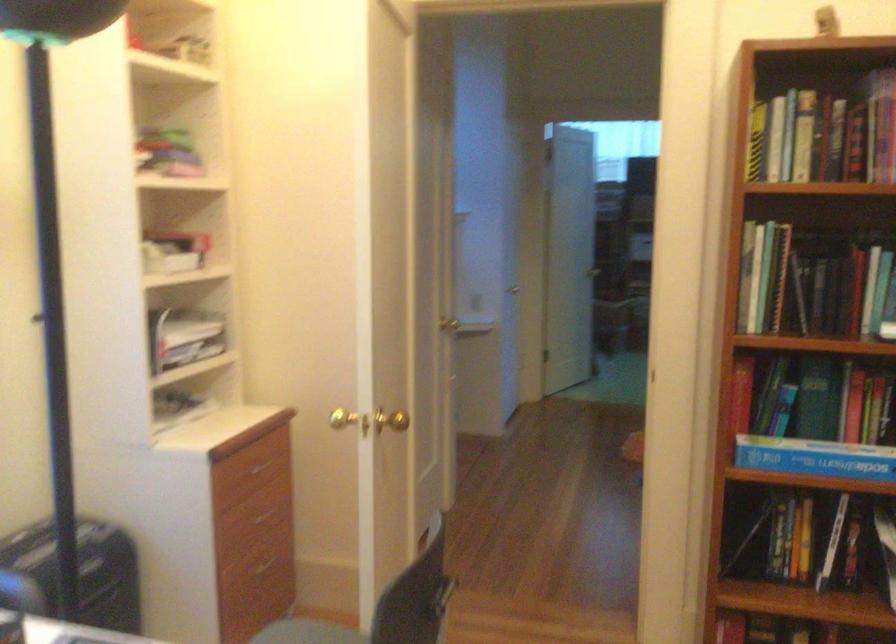
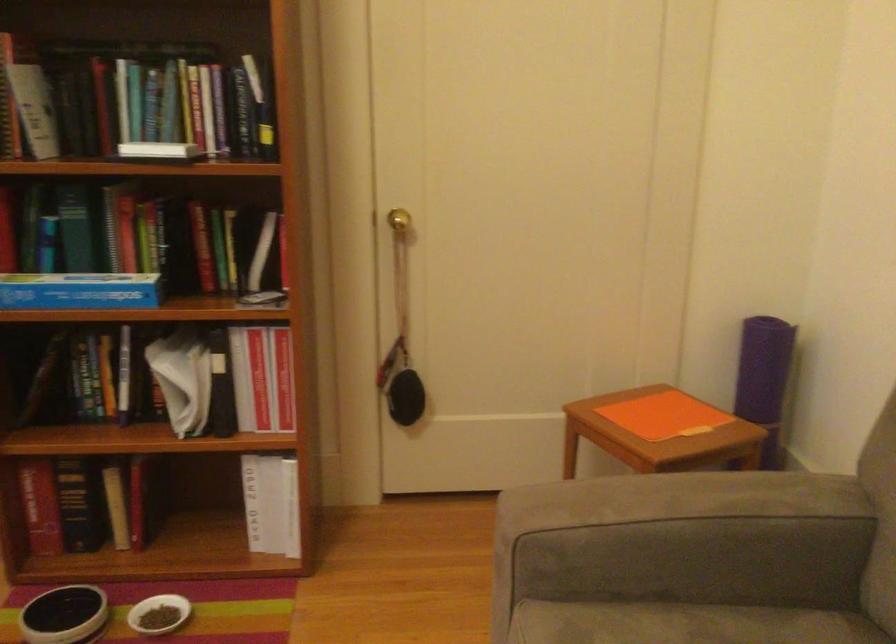
Question: The camera is either moving clockwise (left) or counter-clockwise (right) around the object. The first image is from the beginning of the video and the second image is from the end. Is the camera moving left or right when shooting the video?

Choices:
 (A) Left
 (B) Right

Answer: (A)